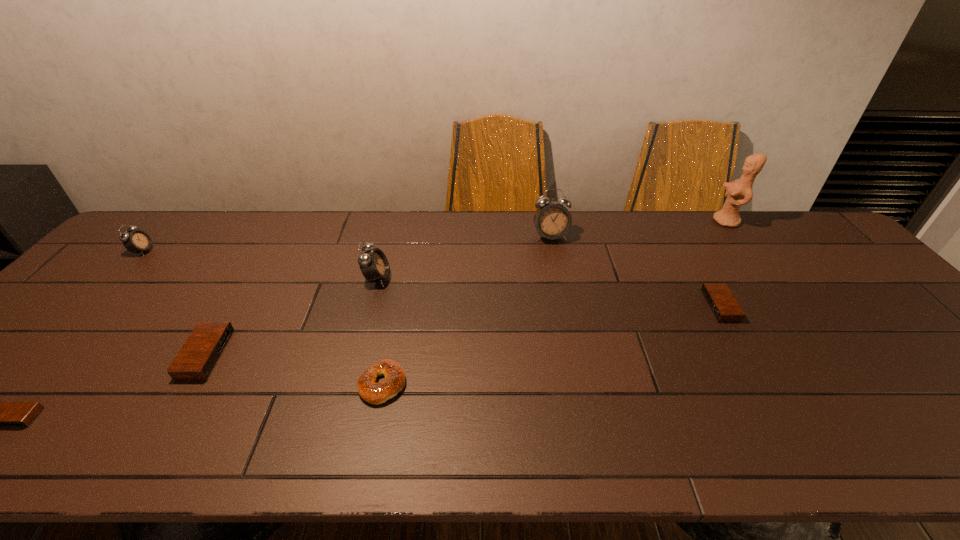
You are a GUI agent. You are given a task and a screenshot of the screen. Output one action in this format:
    pyautogui.click(x=<x>, y=<y>)
    Task: Click on the alarm clock that is the second nearest to the seventh shortest object
    The image size is (960, 540).
    Given the screenshot: What is the action you would take?
    pyautogui.click(x=373, y=263)

Select which alarm clock appears as the sixth closest to the tallest object. Please provide its 2D coordinates. Your answer should be formatted as a tuple, i.e. [(x, y)], where the tuple contains the x and y coordinates of a point satisfying the conditions above.

[(0, 414)]

Choose which white alarm clock is the nearest neighbor to the tallest alarm clock. Please provide its 2D coordinates. Your answer should be formatted as a tuple, i.e. [(x, y)], where the tuple contains the x and y coordinates of a point satisfying the conditions above.

[(373, 263)]

Locate an element on the screen. the closest white alarm clock to the fourth tallest alarm clock is located at coordinates (373, 263).

This screenshot has height=540, width=960. Find the location of `the third closest black alarm clock to the biggest white alarm clock`. the third closest black alarm clock to the biggest white alarm clock is located at coordinates (0, 414).

This screenshot has width=960, height=540. I want to click on black alarm clock that stands as the closest to the fifth alarm clock from left to right, so click(722, 303).

Locate an element on the screen. The width and height of the screenshot is (960, 540). free space that satisfies the following two spatial constraints: 1. on the face of the tallest alarm clock; 2. on the front face of the fourth alarm clock from right to left is located at coordinates (575, 355).

Where is `free space that satisfies the following two spatial constraints: 1. on the front face of the bagel; 2. on the right side of the fifth farthest alarm clock`? This screenshot has height=540, width=960. free space that satisfies the following two spatial constraints: 1. on the front face of the bagel; 2. on the right side of the fifth farthest alarm clock is located at coordinates (189, 384).

The image size is (960, 540). Find the location of `free space in the image that satisfies the following two spatial constraints: 1. on the face of the biggest white alarm clock; 2. on the front face of the second nearest alarm clock`. free space in the image that satisfies the following two spatial constraints: 1. on the face of the biggest white alarm clock; 2. on the front face of the second nearest alarm clock is located at coordinates (575, 355).